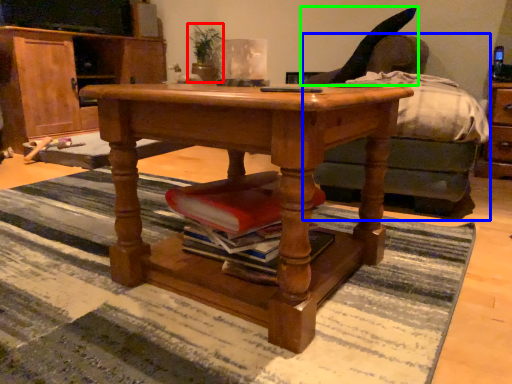
Question: Which object is the farthest from houseplant (highlighted by a red box)? Choose among these: studio couch (highlighted by a blue box) or swivel chair (highlighted by a green box).

Choices:
 (A) studio couch
 (B) swivel chair

Answer: (A)